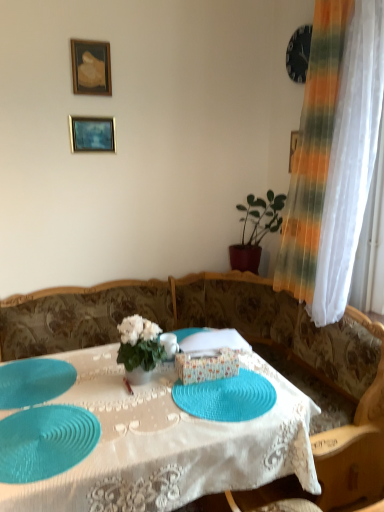
Identify the location of vacant space underneath teal woven placemat at center, which ranks as the first glass plate in right-to-left order (from a real-world perspective). This screenshot has width=384, height=512. (233, 398).